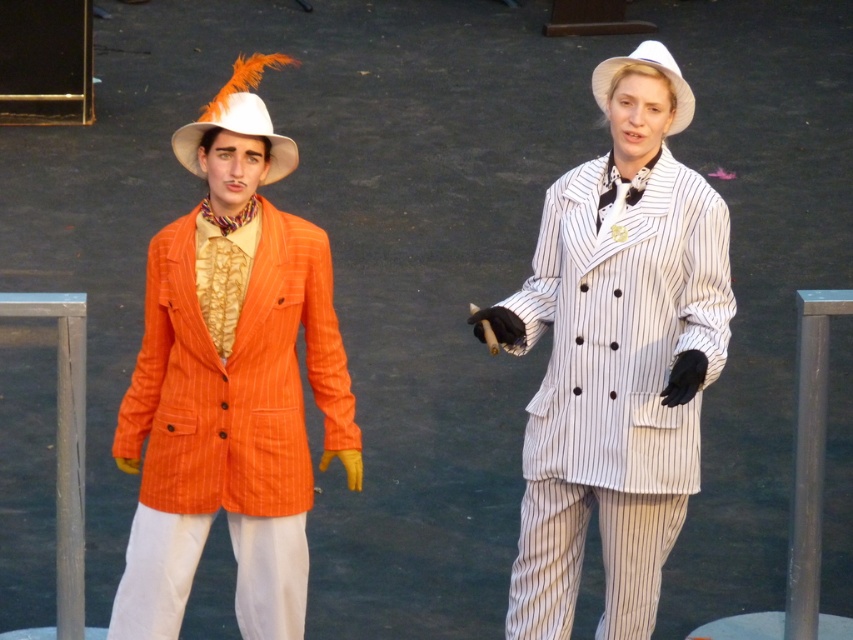
You are a photographer standing in front of the two performers. You notice two points marked in the image. Which point, point (242,621) or point (689,115), is closer to your camera?

Point (242,621) is further to the camera than point (689,115), so the closer point to your camera is point (689,115).

You are a stagehand setting up for a performance. You need to place a ladder to reach the matte white cowboy hat at left, which is above the white pinstriped suit at center. Where should you position the ladder?

The white pinstriped suit at center is located below the matte white cowboy hat at left, so the ladder should be placed near the white pinstriped suit at center to reach the matte white cowboy hat at left.

You are a costume designer preparing for a play. You have two matte white cowboy hats. One is labeled as the matte white cowboy hat at left, and the other is the white matte cowboy hat at center. Which hat has a smaller width?

The matte white cowboy hat at left has a lesser width compared to the white matte cowboy hat at center, so the matte white cowboy hat at left is the smaller one.